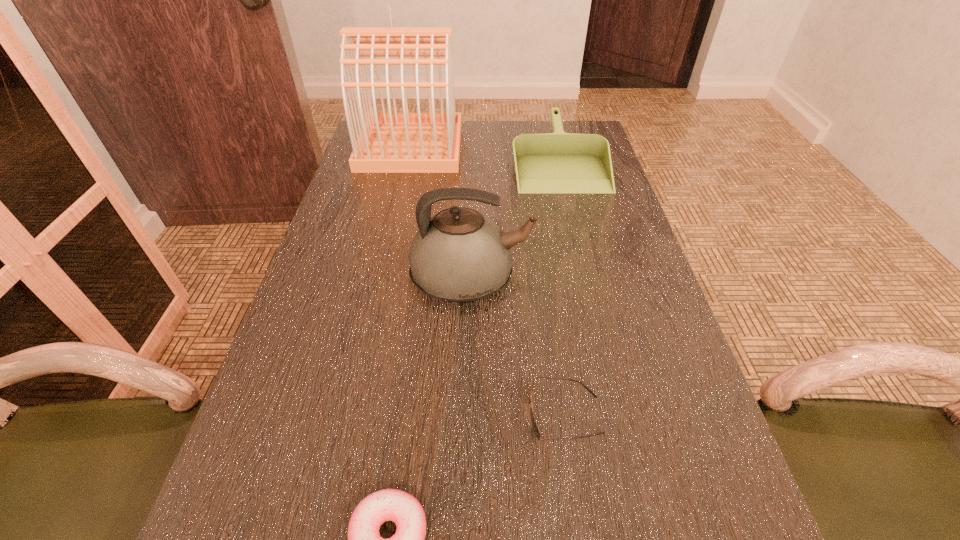
This screenshot has width=960, height=540. Identify the location of free spot between the sunglasses and the dustpan. (562, 287).

Locate an element on the screen. Image resolution: width=960 pixels, height=540 pixels. vacant region between the third nearest object and the second nearest object is located at coordinates (517, 347).

Where is `empty location between the dustpan and the tallest object`? The width and height of the screenshot is (960, 540). empty location between the dustpan and the tallest object is located at coordinates (485, 153).

Image resolution: width=960 pixels, height=540 pixels. I want to click on free space between the second nearest object and the third shortest object, so click(x=562, y=287).

Locate an element on the screen. Image resolution: width=960 pixels, height=540 pixels. object that is the third closest to the dustpan is located at coordinates (534, 425).

Point out which object is positioned as the nearest to the dustpan. Please provide its 2D coordinates. Your answer should be formatted as a tuple, i.e. [(x, y)], where the tuple contains the x and y coordinates of a point satisfying the conditions above.

[(388, 142)]

Identify the location of vacant space that satisfies the following two spatial constraints: 1. on the scoop of the dustpan; 2. at the spout of the third farthest object. The width and height of the screenshot is (960, 540). (588, 279).

The image size is (960, 540). I want to click on free space in the image that satisfies the following two spatial constraints: 1. on the scoop of the third tallest object; 2. on the front-facing side of the sunglasses, so click(x=621, y=415).